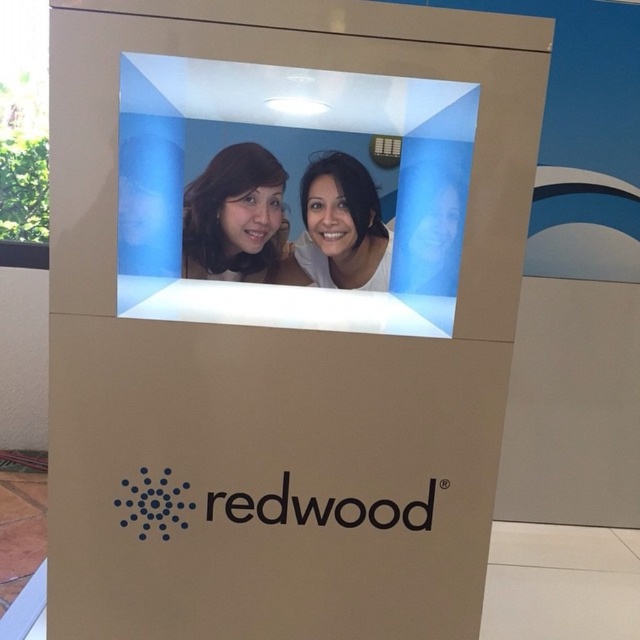
Does matte black hair at center lie in front of matte white face at center?

That is True.

Who is more forward, (256,180) or (349,156)?

Point (256,180)

Locate an element on the screen. matte black hair at center is located at coordinates (234, 216).